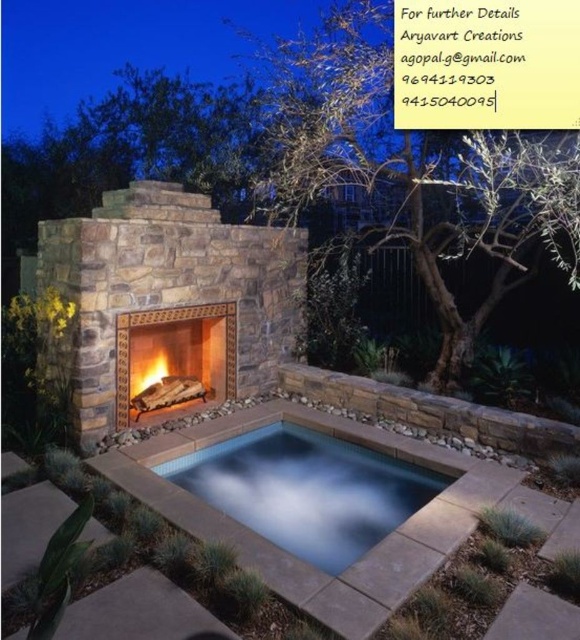
Question: Which of the following is the farthest from the observer?

Choices:
 (A) matte stone fireplace at center
 (B) clear glass pool at center

Answer: (A)

Question: Which point is closer to the camera?

Choices:
 (A) (200, 316)
 (B) (444, 481)

Answer: (B)

Question: Considering the relative positions of clear glass pool at center and matte stone fireplace at center in the image provided, where is clear glass pool at center located with respect to matte stone fireplace at center?

Choices:
 (A) below
 (B) above

Answer: (A)

Question: Does clear glass pool at center have a greater width compared to matte stone fireplace at center?

Choices:
 (A) no
 (B) yes

Answer: (B)

Question: Does clear glass pool at center come in front of matte stone fireplace at center?

Choices:
 (A) yes
 (B) no

Answer: (A)

Question: Among these points, which one is farthest from the camera?

Choices:
 (A) (233, 356)
 (B) (320, 492)

Answer: (A)